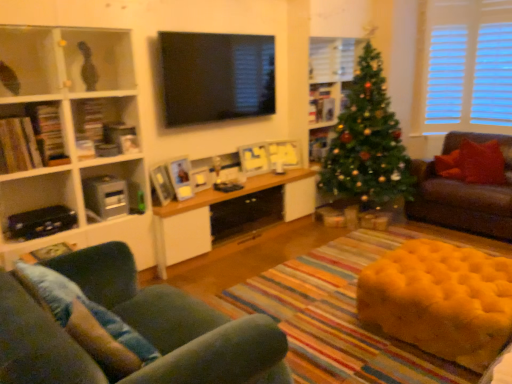
In order to click on free space above metallic gray cabinet at left, the third shelf from the front (from a real-world perspective) in this screenshot , I will do `click(104, 171)`.